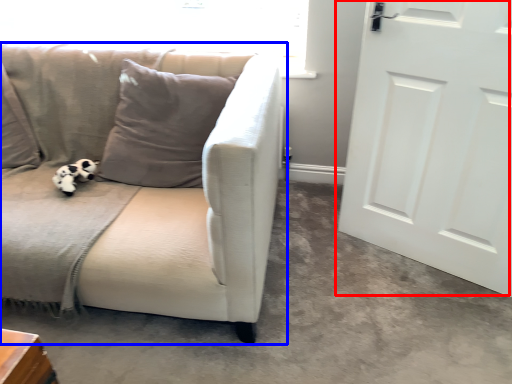
Question: Which of the following is the closest to the observer, door (highlighted by a red box) or studio couch (highlighted by a blue box)?

Choices:
 (A) door
 (B) studio couch

Answer: (B)